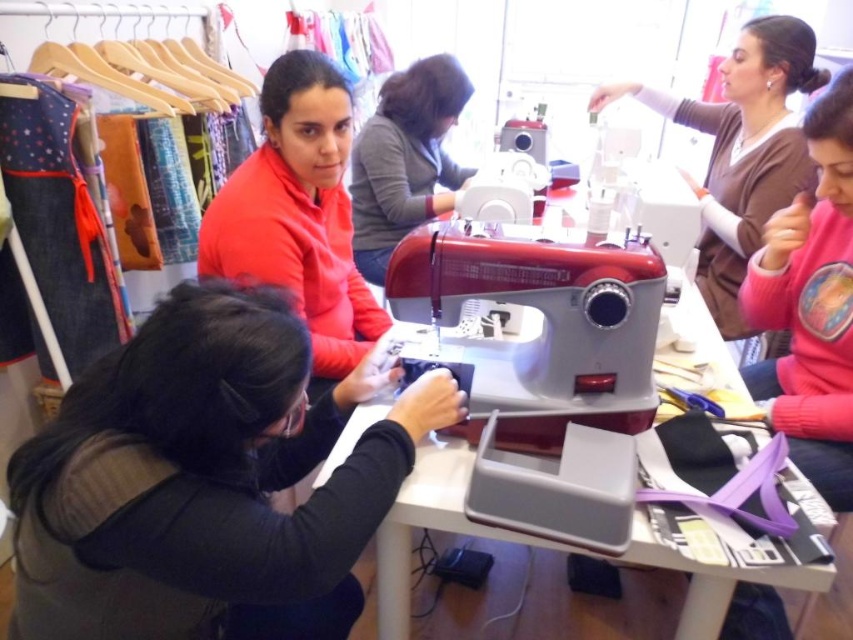
What do you see at coordinates (741, 150) in the screenshot?
I see `matte brown sweater at upper right` at bounding box center [741, 150].

I want to click on matte brown sweater at upper right, so click(741, 150).

Does black matte fabric at lower left have a lesser width compared to matte brown sweater at upper right?

In fact, black matte fabric at lower left might be wider than matte brown sweater at upper right.

Does point (380, 520) lie in front of point (778, 65)?

Yes, it is.

The image size is (853, 640). I want to click on black matte fabric at lower left, so click(207, 481).

Who is taller, white plastic table at center or matte gray sewing machine at center?

Standing taller between the two is matte gray sewing machine at center.

Does point (338, 464) come behind point (438, 65)?

No, it is in front of (438, 65).

What are the coordinates of `white plastic table at center` in the screenshot? It's located at (427, 528).